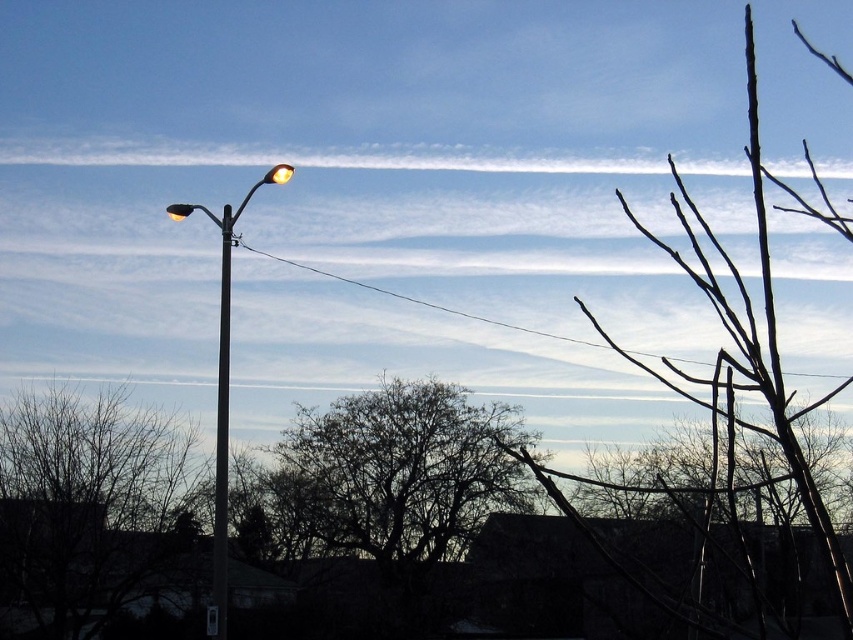
You are an artist trying to sketch this scene. You want to ensure the proportions between the brown bare branches at center and the metallic pole at left are accurate. Which object should you draw smaller to maintain the correct size relationship?

The brown bare branches at center occupies less space than metallic pole at left, so you should draw the brown bare branches at center smaller than the metallic pole at left to maintain the correct size relationship.

You are a city planner assessing the placement of streetlights and poles. You see the metallic street light at left and the metallic pole at left. Which one is taller?

The metallic street light at left is taller than the metallic pole at left.